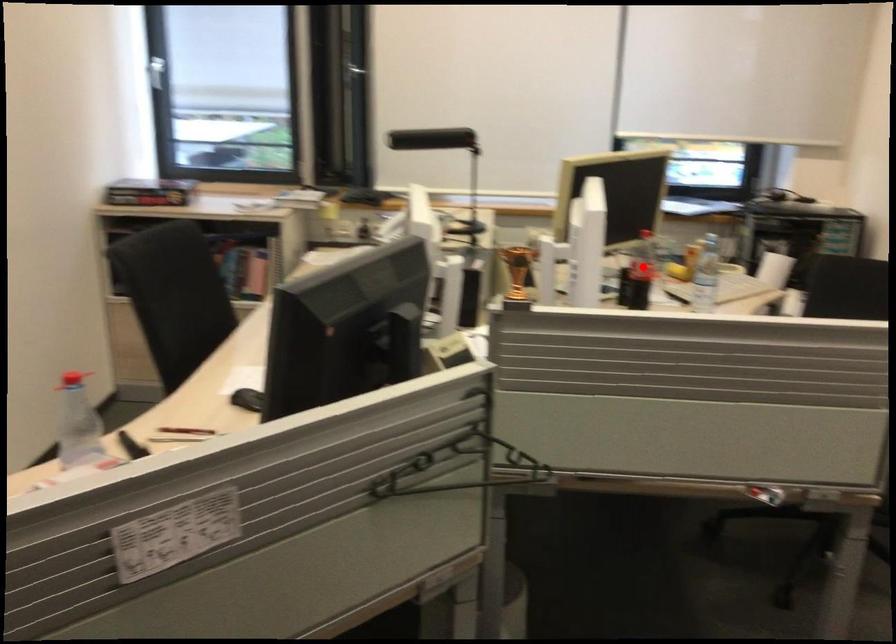
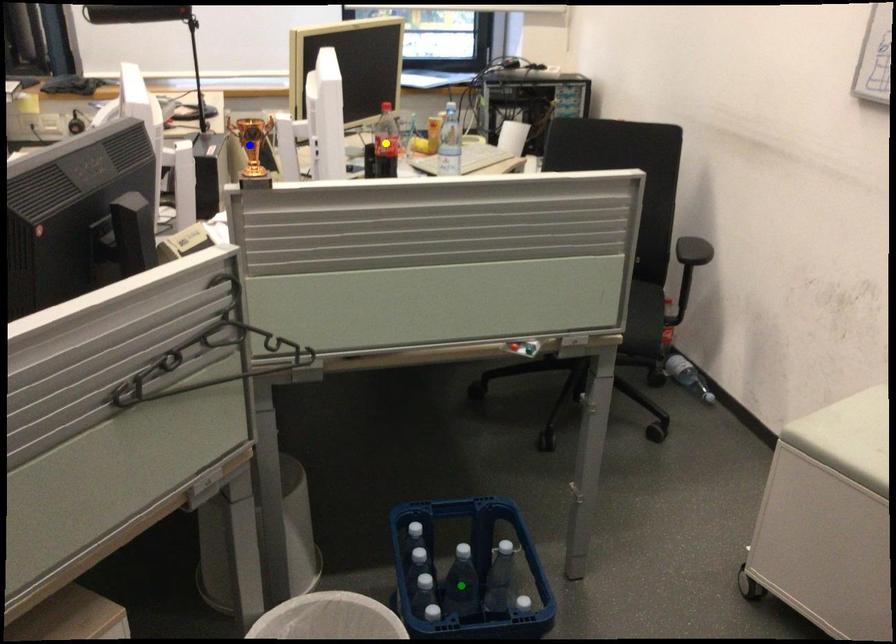
Question: I am providing you with two images of the same scene from different viewpoints. A red point is marked on the first image. You are given multiple points on the second image. Which point in image 2 is actually the same real-world point as the red point in image 1?

Choices:
 (A) green point
 (B) yellow point
 (C) blue point

Answer: (B)